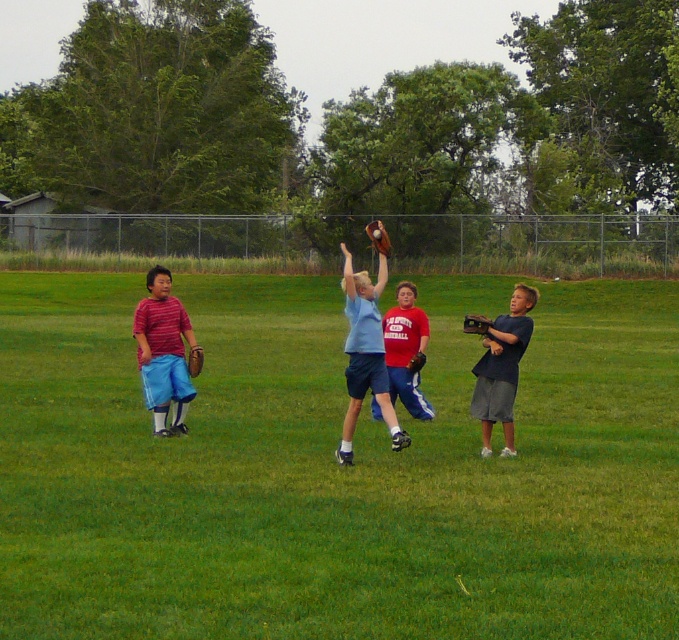
Is brown leather glove at upper center shorter than brown leather glove at left?

In fact, brown leather glove at upper center may be taller than brown leather glove at left.

Identify the location of brown leather glove at upper center. (378, 236).

Can you confirm if dark blue jersey at right is taller than dark brown leather glove at center?

Correct, dark blue jersey at right is much taller as dark brown leather glove at center.

Where is `dark blue jersey at right`? This screenshot has height=640, width=679. dark blue jersey at right is located at coordinates pos(500,369).

Is point (576, 371) closer to camera compared to point (488, 323)?

No, (576, 371) is behind (488, 323).

Is green grass field at center below brown leather glove at center?

Correct, green grass field at center is located below brown leather glove at center.

Who is more distant from viewer, (x=663, y=312) or (x=473, y=314)?

Positioned behind is point (x=663, y=312).

Locate an element on the screen. green grass field at center is located at coordinates 335,468.